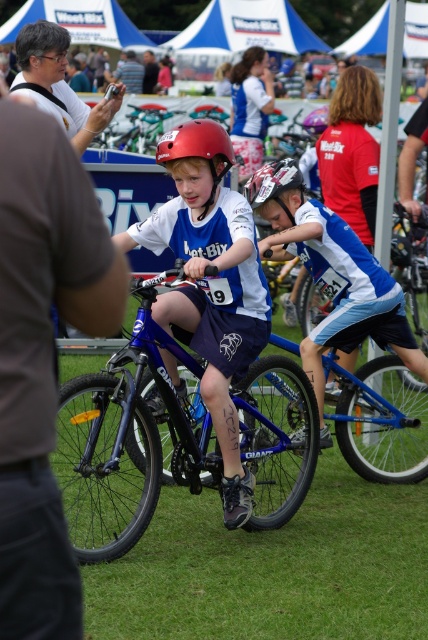
Does matte blue jersey at center appear over matte black helmet at upper center?

Incorrect, matte blue jersey at center is not positioned above matte black helmet at upper center.

Locate an element on the screen. matte blue jersey at center is located at coordinates (211, 284).

Find the location of a particular element. The height and width of the screenshot is (640, 428). matte blue jersey at center is located at coordinates (211, 284).

Is brown fabric shirt at left wider than blue jersey at center?

In fact, brown fabric shirt at left might be narrower than blue jersey at center.

Which is behind, point (65, 582) or point (261, 211)?

Positioned behind is point (261, 211).

Find the location of `brown fabric shirt at left`. brown fabric shirt at left is located at coordinates (42, 358).

Does blue jersey at center have a smaller size compared to dark blue shirt at center?

Actually, blue jersey at center might be larger than dark blue shirt at center.

Who is positioned more to the right, blue jersey at center or dark blue shirt at center?

blue jersey at center

This screenshot has height=640, width=428. What are the coordinates of `blue jersey at center` in the screenshot? It's located at (x=332, y=275).

Find the location of a particular element. This screenshot has width=428, height=640. blue jersey at center is located at coordinates (332, 275).